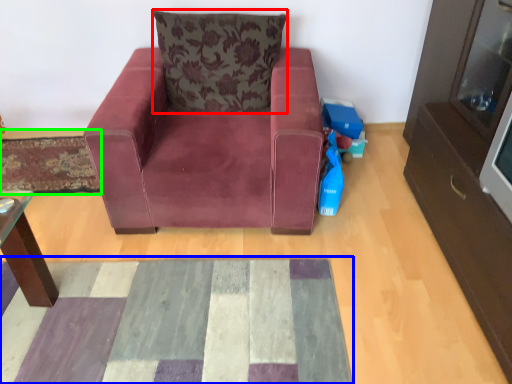
Question: Which is farther away from pillow (highlighted by a red box)? mat (highlighted by a blue box) or mat (highlighted by a green box)?

Choices:
 (A) mat
 (B) mat

Answer: (A)